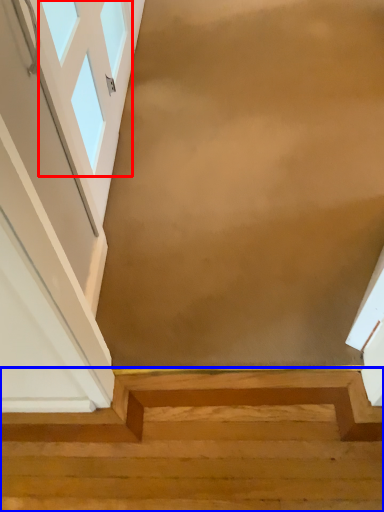
Question: Which object appears closest to the camera in this image, window (highlighted by a red box) or stairs (highlighted by a blue box)?

Choices:
 (A) window
 (B) stairs

Answer: (A)